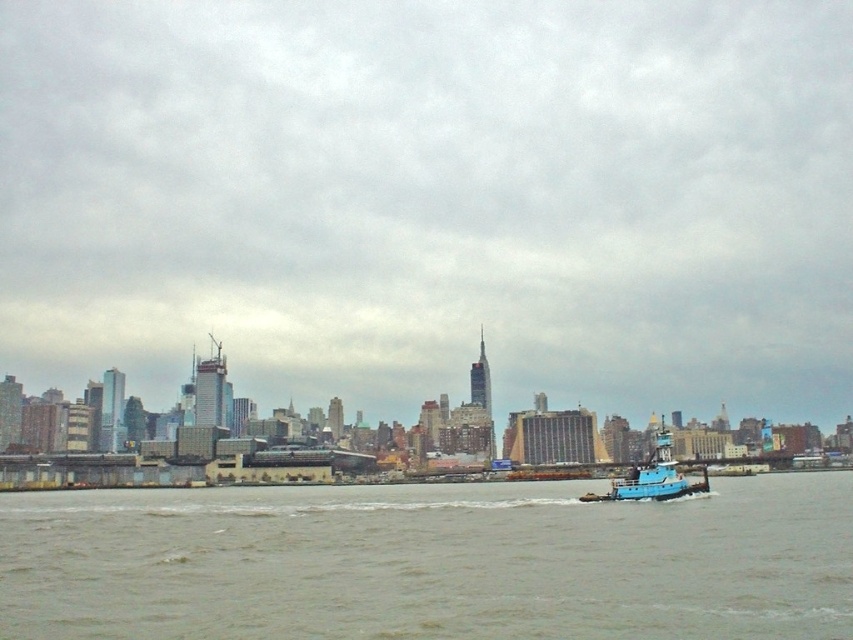
Question: Which point is farther to the camera?

Choices:
 (A) gray concrete river at lower center
 (B) blue matte tugboat at lower right

Answer: (B)

Question: In this image, where is matte gray sky at center located relative to blue matte tugboat at lower right?

Choices:
 (A) below
 (B) above

Answer: (B)

Question: Is matte gray sky at center behind blue matte tugboat at lower right?

Choices:
 (A) yes
 (B) no

Answer: (A)

Question: From the image, what is the correct spatial relationship of matte gray sky at center in relation to gray concrete river at lower center?

Choices:
 (A) right
 (B) left

Answer: (B)

Question: Which object appears farthest from the camera in this image?

Choices:
 (A) blue matte tugboat at lower right
 (B) gray concrete river at lower center

Answer: (A)

Question: Which of the following is the farthest from the observer?

Choices:
 (A) matte gray sky at center
 (B) gray concrete river at lower center
 (C) blue matte tugboat at lower right

Answer: (A)